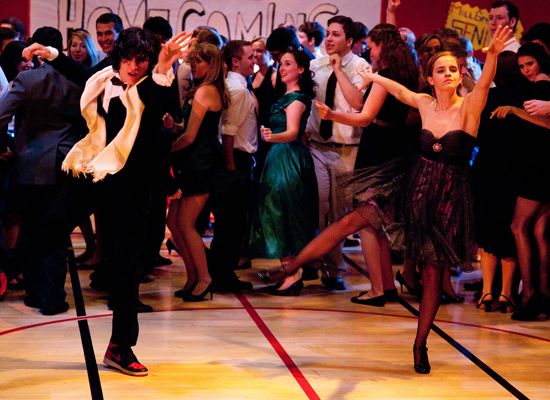
What are the coordinates of `shoe of male dancer in middle of floor` in the screenshot? It's located at (x=125, y=368).